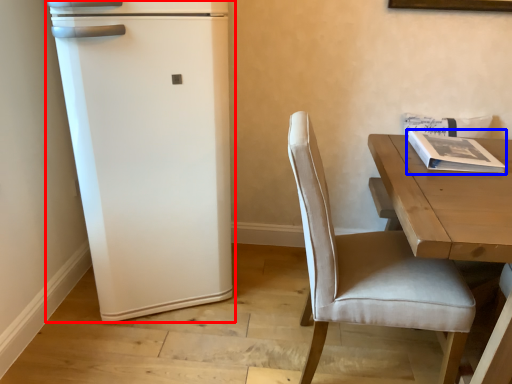
Question: Which object is closer to the camera taking this photo, refrigerator (highlighted by a red box) or magazine (highlighted by a blue box)?

Choices:
 (A) refrigerator
 (B) magazine

Answer: (A)